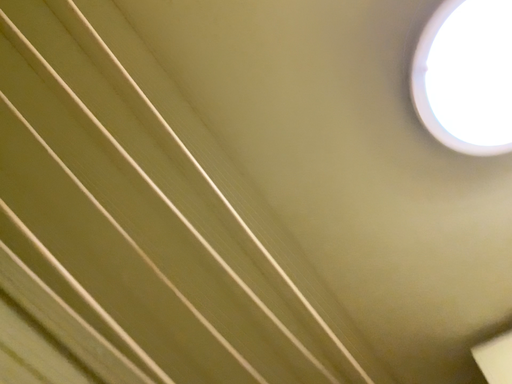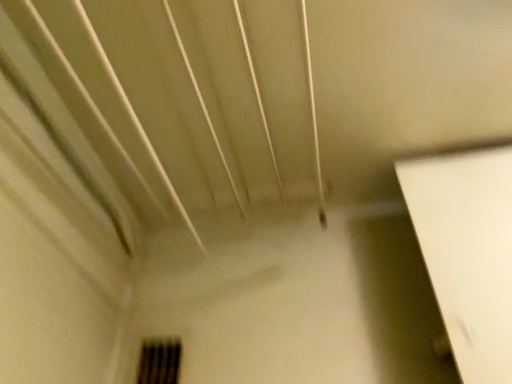
Question: Which way did the camera rotate in the video?

Choices:
 (A) rotated right
 (B) rotated left

Answer: (A)